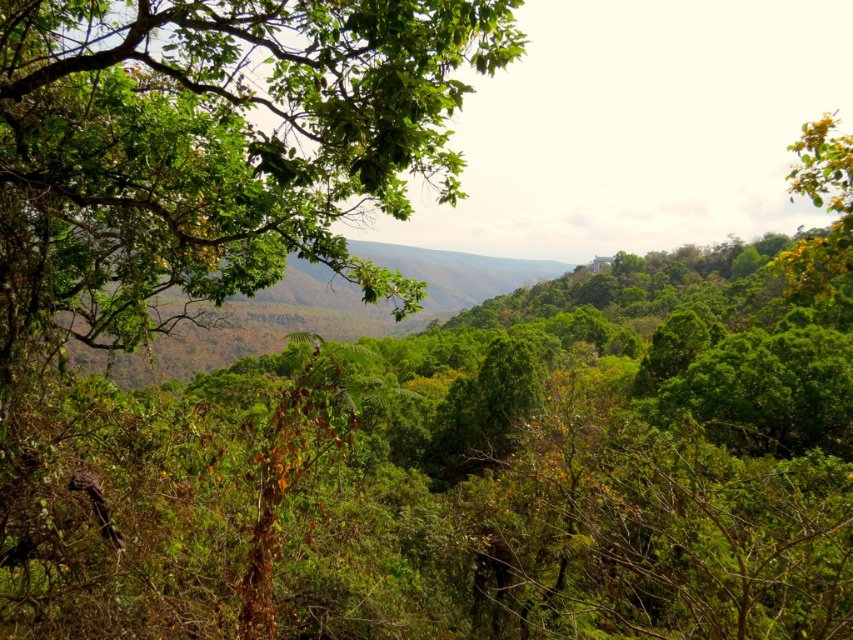
Question: Is green leafy tree at upper left further to camera compared to green leafy tree at upper right?

Choices:
 (A) yes
 (B) no

Answer: (B)

Question: Which point is farther to the camera?

Choices:
 (A) green leafy tree at upper right
 (B) green leafy tree at upper left

Answer: (A)

Question: Among these objects, which one is farthest from the camera?

Choices:
 (A) green leafy tree at upper right
 (B) green leafy tree at upper left

Answer: (A)

Question: Can you confirm if green leafy tree at upper left is positioned to the right of green leafy tree at upper right?

Choices:
 (A) yes
 (B) no

Answer: (B)

Question: Considering the relative positions of green leafy tree at upper left and green leafy tree at upper right in the image provided, where is green leafy tree at upper left located with respect to green leafy tree at upper right?

Choices:
 (A) right
 (B) left

Answer: (B)